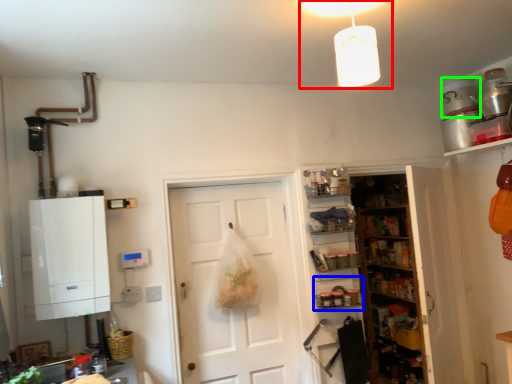
Question: Estimate the real-world distances between objects in this image. Which object is closer to light fixture (highlighted by a red box), shelf (highlighted by a blue box) or appliance (highlighted by a green box)?

Choices:
 (A) shelf
 (B) appliance

Answer: (B)